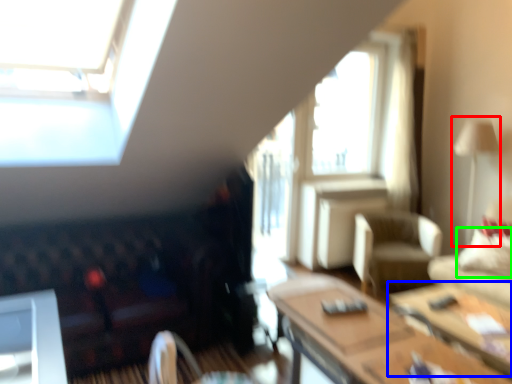
Question: Which is nearer to the lamp (highlighted by a red box)? table (highlighted by a blue box) or pillow (highlighted by a green box).

Choices:
 (A) table
 (B) pillow

Answer: (B)